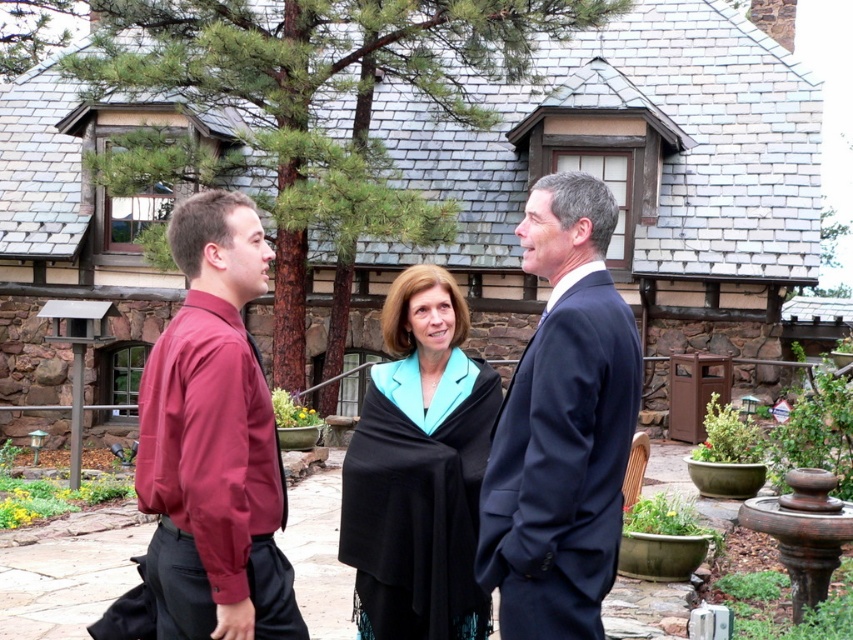
Question: Which point is closer to the camera?

Choices:
 (A) maroon fabric shirt at left
 (B) dark blue suit at center

Answer: (A)

Question: Considering the relative positions of matte black suit at center and maroon fabric shirt at left in the image provided, where is matte black suit at center located with respect to maroon fabric shirt at left?

Choices:
 (A) below
 (B) above

Answer: (A)

Question: Does matte black suit at center come behind black woolen shawl at center?

Choices:
 (A) no
 (B) yes

Answer: (A)

Question: Which of these objects is positioned farthest from the matte black suit at center?

Choices:
 (A) dark blue suit at center
 (B) black woolen shawl at center

Answer: (A)

Question: Does dark blue suit at center appear under maroon fabric shirt at left?

Choices:
 (A) yes
 (B) no

Answer: (B)

Question: Which object is positioned farthest from the dark blue suit at center?

Choices:
 (A) maroon fabric shirt at left
 (B) matte black suit at center

Answer: (A)